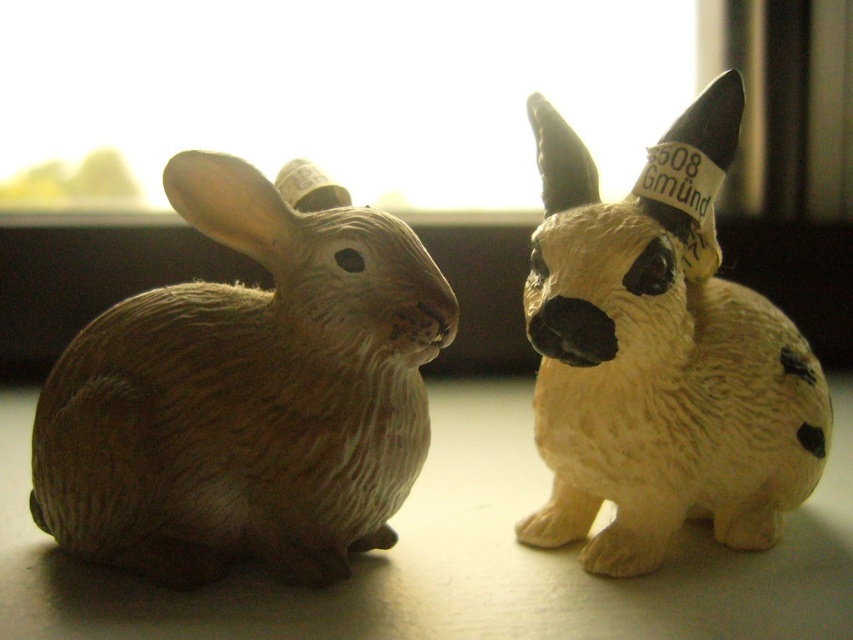
Question: Which point appears farthest from the camera in this image?

Choices:
 (A) (219, 456)
 (B) (672, 257)

Answer: (B)

Question: Which point is closer to the camera?

Choices:
 (A) (656, 305)
 (B) (358, 451)

Answer: (A)

Question: Is matte brown rabbit at left positioned at the back of matte beige rabbit at right?

Choices:
 (A) yes
 (B) no

Answer: (A)

Question: Does matte brown rabbit at left lie behind matte beige rabbit at right?

Choices:
 (A) no
 (B) yes

Answer: (B)

Question: Among these objects, which one is nearest to the camera?

Choices:
 (A) matte beige rabbit at right
 (B) matte brown rabbit at left

Answer: (A)

Question: Can you confirm if matte brown rabbit at left is wider than matte beige rabbit at right?

Choices:
 (A) yes
 (B) no

Answer: (A)